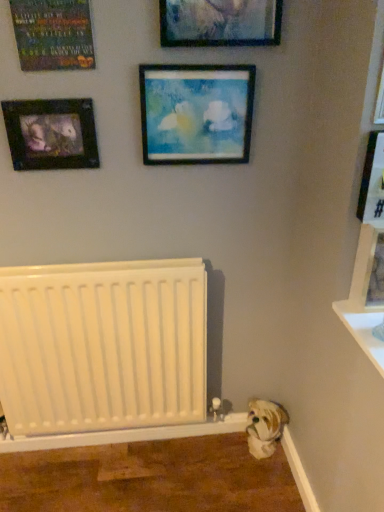
Question: Is matte black poster at upper left, which appears as the 2th picture frame when viewed from the left, thinner than wooden picture frame at right, acting as the 6th picture frame starting from the left?

Choices:
 (A) no
 (B) yes

Answer: (B)

Question: From the image's perspective, would you say matte black poster at upper left, the 6th picture frame when ordered from right to left, is shown under wooden picture frame at right, acting as the 6th picture frame starting from the left?

Choices:
 (A) no
 (B) yes

Answer: (A)

Question: Considering the relative positions of matte black poster at upper left, which appears as the 2th picture frame when viewed from the left, and wooden picture frame at right, marked as the 2th picture frame in a right-to-left arrangement, in the image provided, is matte black poster at upper left, which appears as the 2th picture frame when viewed from the left, to the right of wooden picture frame at right, marked as the 2th picture frame in a right-to-left arrangement, from the viewer's perspective?

Choices:
 (A) yes
 (B) no

Answer: (B)

Question: Does matte black poster at upper left, the 6th picture frame when ordered from right to left, touch wooden picture frame at right, marked as the 2th picture frame in a right-to-left arrangement?

Choices:
 (A) no
 (B) yes

Answer: (A)

Question: Would you consider matte black poster at upper left, which appears as the 2th picture frame when viewed from the left, to be distant from wooden picture frame at right, marked as the 2th picture frame in a right-to-left arrangement?

Choices:
 (A) no
 (B) yes

Answer: (A)

Question: From the image's perspective, is matte black poster at upper left, which appears as the 2th picture frame when viewed from the left, on wooden picture frame at right, marked as the 2th picture frame in a right-to-left arrangement?

Choices:
 (A) yes
 (B) no

Answer: (A)

Question: Considering the relative positions of matte glass picture frame at upper center, the 4th picture frame from the left, and wooden picture frame at right, marked as the 2th picture frame in a right-to-left arrangement, in the image provided, is matte glass picture frame at upper center, the 4th picture frame from the left, to the right of wooden picture frame at right, marked as the 2th picture frame in a right-to-left arrangement, from the viewer's perspective?

Choices:
 (A) no
 (B) yes

Answer: (A)

Question: From the image's perspective, is matte glass picture frame at upper center, the 4th picture frame positioned from the right, located beneath wooden picture frame at right, acting as the 6th picture frame starting from the left?

Choices:
 (A) yes
 (B) no

Answer: (B)

Question: Is matte glass picture frame at upper center, the 4th picture frame from the left, bigger than wooden picture frame at right, marked as the 2th picture frame in a right-to-left arrangement?

Choices:
 (A) no
 (B) yes

Answer: (B)

Question: Does matte glass picture frame at upper center, the 4th picture frame positioned from the right, appear on the left side of wooden picture frame at right, marked as the 2th picture frame in a right-to-left arrangement?

Choices:
 (A) no
 (B) yes

Answer: (B)

Question: Could you tell me if matte glass picture frame at upper center, the 4th picture frame from the left, is turned towards wooden picture frame at right, acting as the 6th picture frame starting from the left?

Choices:
 (A) yes
 (B) no

Answer: (B)

Question: Is matte glass picture frame at upper center, the 4th picture frame positioned from the right, placed right next to wooden picture frame at right, acting as the 6th picture frame starting from the left?

Choices:
 (A) yes
 (B) no

Answer: (B)

Question: From the image's perspective, is wooden picture frame at right, acting as the 6th picture frame starting from the left, on top of wooden frame at center, marked as the fifth picture frame in a right-to-left arrangement?

Choices:
 (A) yes
 (B) no

Answer: (B)